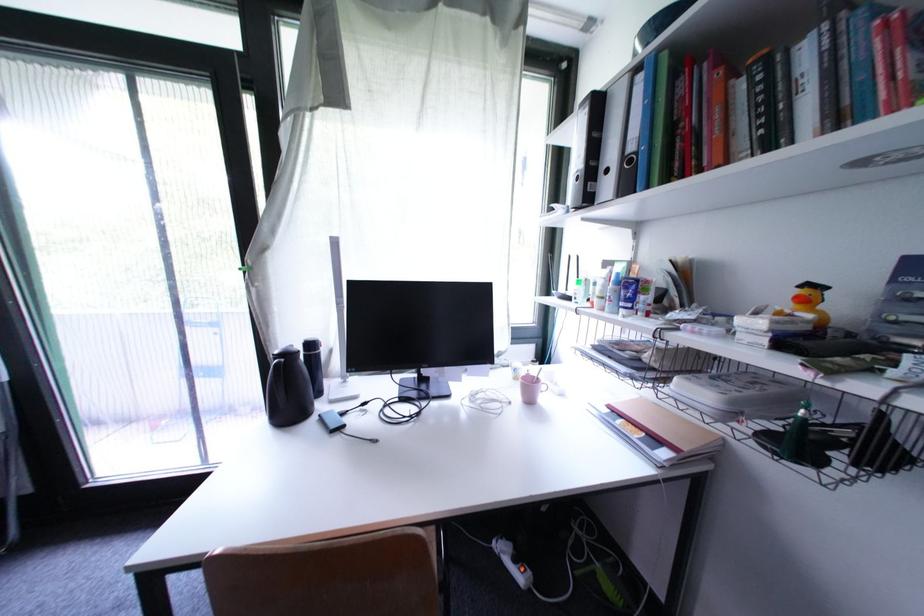
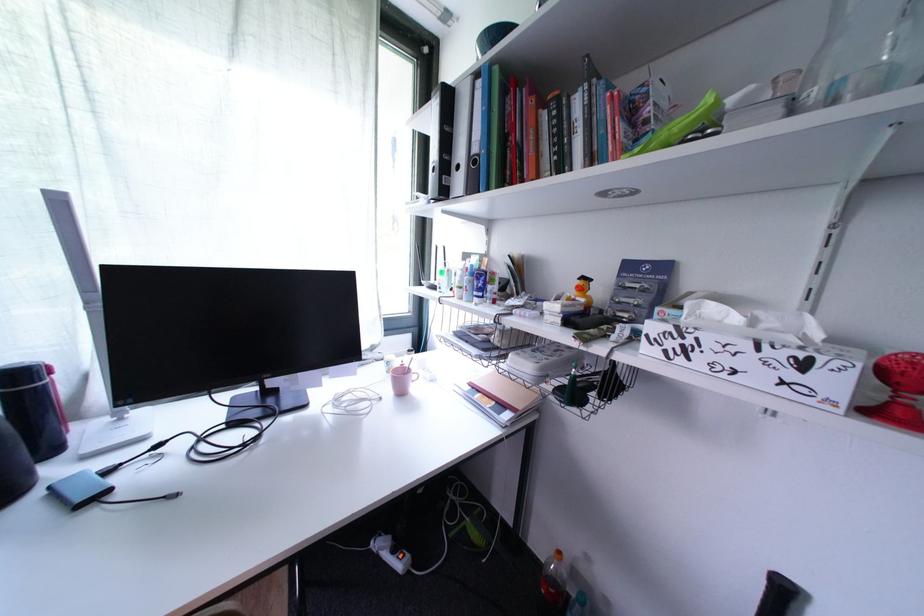
Where in the second image is the point corresponding to the point at 329,422 from the first image?

(63, 496)